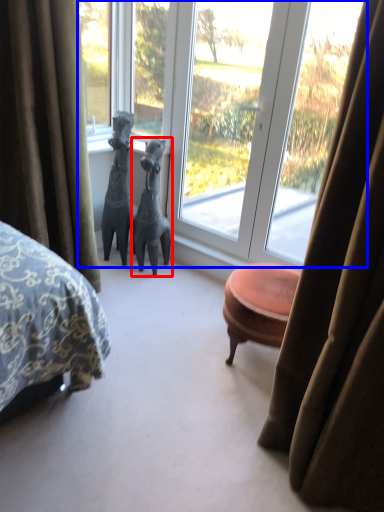
Question: Which object is closer to the camera taking this photo, animal (highlighted by a red box) or window (highlighted by a blue box)?

Choices:
 (A) animal
 (B) window

Answer: (B)